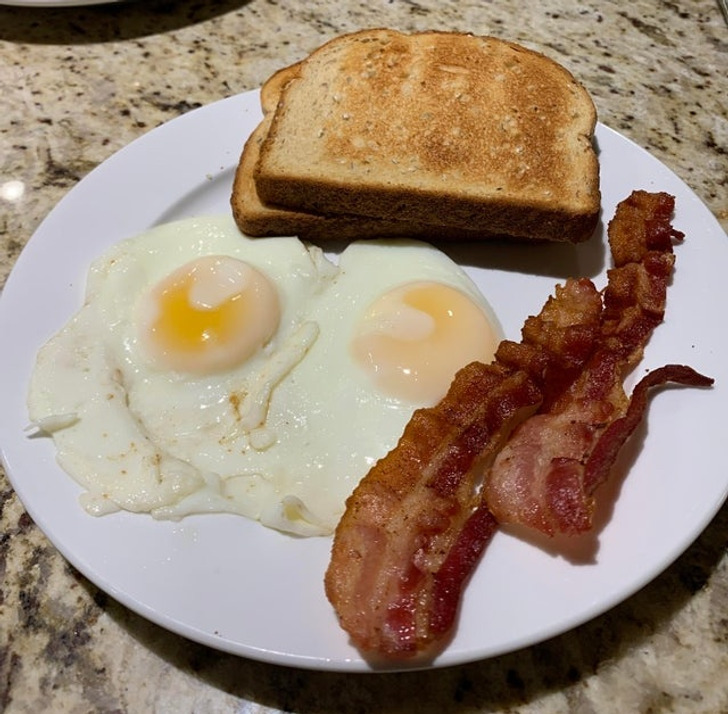
Where is `marble`? marble is located at coordinates (146, 668).